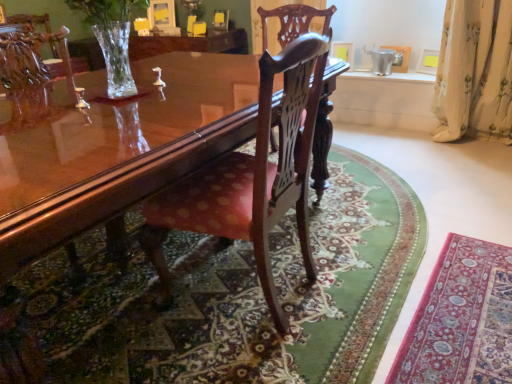
In order to click on vacant space underneath white floral fabric curtain at right (from a real-world perspective) in this screenshot , I will do `click(467, 144)`.